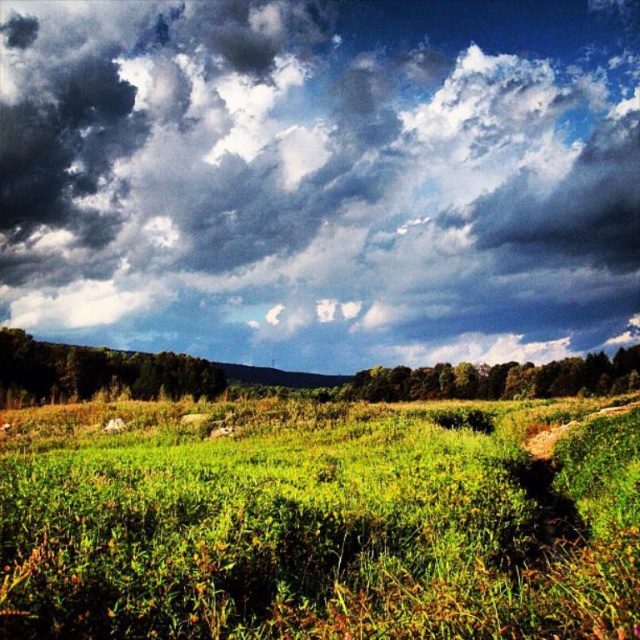
You are standing in the green grassy field at center and looking up at the sky. Which direction should you turn your head to see the dark fluffy cloud at upper center?

You should turn your head to the left to see the dark fluffy cloud at upper center because it is positioned to the left of the green grassy field at center.